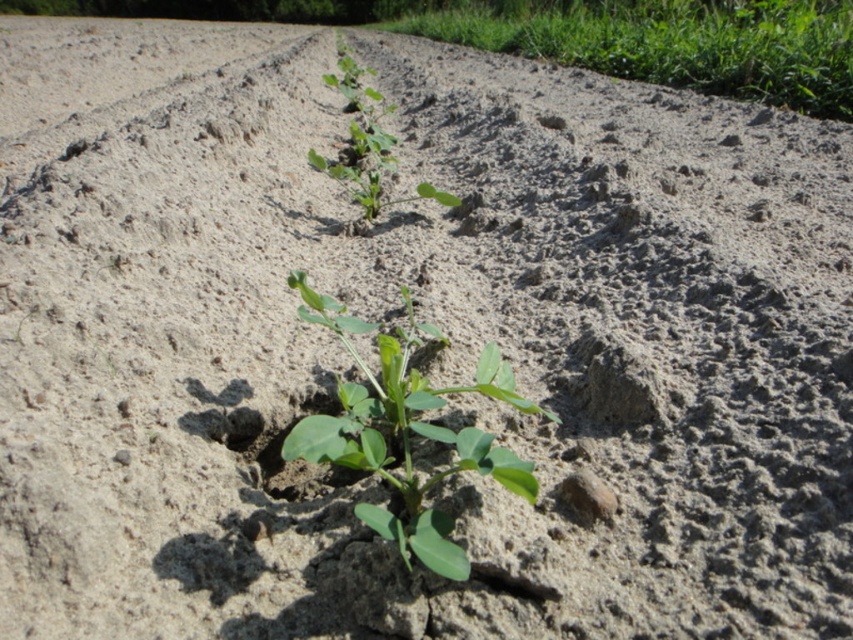
Between green leafy plant at upper right and green matte plant at center, which one is positioned lower?

green matte plant at center is below.

Can you confirm if green leafy plant at upper right is shorter than green matte plant at center?

No.

Who is more forward, (712,44) or (363,515)?

Point (363,515) is more forward.

Image resolution: width=853 pixels, height=640 pixels. I want to click on green leafy plant at upper right, so click(x=672, y=42).

Is point (398, 545) positioned before point (310, 150)?

Yes.

Locate an element on the screen. Image resolution: width=853 pixels, height=640 pixels. green matte plant at center is located at coordinates (405, 429).

Measure the distance between green leafy plant at upper right and camera.

green leafy plant at upper right is 3.60 meters away from camera.

Does green leafy plant at upper right have a greater width compared to green leafy plant at center?

Correct, the width of green leafy plant at upper right exceeds that of green leafy plant at center.

The height and width of the screenshot is (640, 853). Describe the element at coordinates (672, 42) in the screenshot. I see `green leafy plant at upper right` at that location.

Identify the location of green leafy plant at upper right. (672, 42).